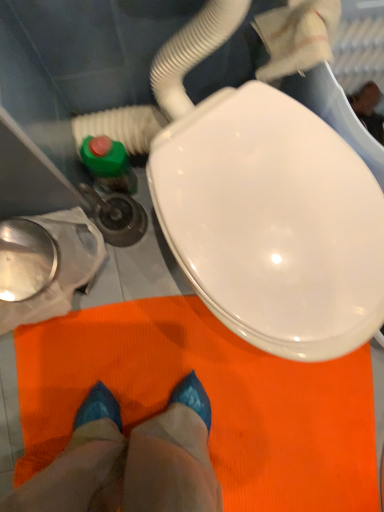
You are a GUI agent. You are given a task and a screenshot of the screen. Output one action in this format:
    pyautogui.click(x=<x>, y=<y>)
    Task: Click on the free spot above blue glossy shoes at center (from a real-world perspective)
    This screenshot has width=384, height=512.
    Given the screenshot: What is the action you would take?
    pyautogui.click(x=148, y=400)